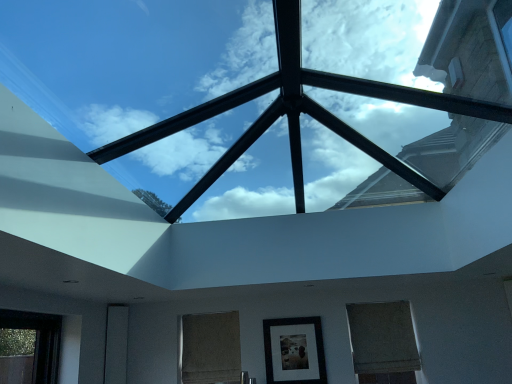
Describe the element at coordinates (211, 348) in the screenshot. I see `burlap curtain at center, which is counted as the 1th window, starting from the left` at that location.

You are a GUI agent. You are given a task and a screenshot of the screen. Output one action in this format:
    pyautogui.click(x=<x>, y=<y>)
    Task: Click on the transparent glass skylight at center
    Image resolution: width=512 pixels, height=384 pixels.
    Given the screenshot: What is the action you would take?
    pyautogui.click(x=280, y=116)

Is matte brown blind at lower right, which ranks as the 1th window in right-to-left order, further to camera compared to transparent glass skylight at center?

Yes.

Considering the positions of objects matte brown blind at lower right, which ranks as the 1th window in right-to-left order, and transparent glass skylight at center in the image provided, who is more to the right, matte brown blind at lower right, which ranks as the 1th window in right-to-left order, or transparent glass skylight at center?

Positioned to the right is matte brown blind at lower right, which ranks as the 1th window in right-to-left order.

Which of these two, matte brown blind at lower right, the 2th window positioned from the left, or transparent glass skylight at center, is wider?

Wider between the two is transparent glass skylight at center.

Does point (397, 312) appear closer or farther from the camera than point (244, 137)?

Point (397, 312) is positioned farther from the camera compared to point (244, 137).

From a real-world perspective, is burlap curtain at center, which is counted as the 1th window, starting from the left, physically above matte black glass door at lower left?

No, from a real-world perspective, burlap curtain at center, which is counted as the 1th window, starting from the left, is not over matte black glass door at lower left

Based on their sizes in the image, would you say burlap curtain at center, which is counted as the 1th window, starting from the left, is bigger or smaller than matte black glass door at lower left?

Considering their sizes, burlap curtain at center, which is counted as the 1th window, starting from the left, takes up more space than matte black glass door at lower left.

Consider the image. Considering their positions, is burlap curtain at center, the 2th window in the right-to-left sequence, located in front of or behind matte black glass door at lower left?

In the image, burlap curtain at center, the 2th window in the right-to-left sequence, appears behind matte black glass door at lower left.

Which object is wider, transparent glass skylight at center or burlap curtain at center, the 2th window in the right-to-left sequence?

transparent glass skylight at center.

How different are the orientations of transparent glass skylight at center and burlap curtain at center, which is counted as the 1th window, starting from the left, in degrees?

89.4 degrees.

Who is more distant, transparent glass skylight at center or burlap curtain at center, the 2th window in the right-to-left sequence?

burlap curtain at center, the 2th window in the right-to-left sequence, is further away from the camera.

Is point (420, 184) closer or farther from the camera than point (203, 369)?

Point (420, 184).

Is burlap curtain at center, which is counted as the 1th window, starting from the left, turned away from matte brown blind at lower right, which ranks as the 1th window in right-to-left order?

No, matte brown blind at lower right, which ranks as the 1th window in right-to-left order, is not at the back of burlap curtain at center, which is counted as the 1th window, starting from the left.

Considering the relative sizes of burlap curtain at center, which is counted as the 1th window, starting from the left, and matte brown blind at lower right, the 2th window positioned from the left, in the image provided, is burlap curtain at center, which is counted as the 1th window, starting from the left, thinner than matte brown blind at lower right, the 2th window positioned from the left,?

Yes, burlap curtain at center, which is counted as the 1th window, starting from the left, is thinner than matte brown blind at lower right, the 2th window positioned from the left.

Can you tell me how much burlap curtain at center, the 2th window in the right-to-left sequence, and matte brown blind at lower right, which ranks as the 1th window in right-to-left order, differ in facing direction?

0.00255 degrees.

From the image's perspective, is burlap curtain at center, which is counted as the 1th window, starting from the left, below matte brown blind at lower right, which ranks as the 1th window in right-to-left order?

Correct, burlap curtain at center, which is counted as the 1th window, starting from the left, appears lower than matte brown blind at lower right, which ranks as the 1th window in right-to-left order, in the image.

Consider the image. Visually, is matte black glass door at lower left positioned to the left or to the right of matte black picture frame at center?

matte black glass door at lower left is to the left of matte black picture frame at center.

Does point (121, 368) come in front of point (312, 361)?

No, it is behind (312, 361).

Which object is thinner, matte black glass door at lower left or matte black picture frame at center?

With smaller width is matte black picture frame at center.

From the image's perspective, is matte black glass door at lower left located beneath matte black picture frame at center?

Yes.

From a real-world perspective, is transparent glass skylight at center positioned above or below matte black picture frame at center?

transparent glass skylight at center is above matte black picture frame at center.

From the picture: Considering their positions, is transparent glass skylight at center located in front of or behind matte black picture frame at center?

Clearly, transparent glass skylight at center is in front of matte black picture frame at center.

Looking at this image, is transparent glass skylight at center spatially inside matte black picture frame at center, or outside of it?

transparent glass skylight at center is located beyond the bounds of matte black picture frame at center.

From the image's perspective, would you say transparent glass skylight at center is positioned over matte black picture frame at center?

Yes, from the image's perspective, transparent glass skylight at center is above matte black picture frame at center.

Is transparent glass skylight at center at the back of burlap curtain at center, which is counted as the 1th window, starting from the left?

burlap curtain at center, which is counted as the 1th window, starting from the left, does not have its back to transparent glass skylight at center.

From a real-world perspective, is burlap curtain at center, which is counted as the 1th window, starting from the left, located higher than transparent glass skylight at center?

No, from a real-world perspective, burlap curtain at center, which is counted as the 1th window, starting from the left, is not over transparent glass skylight at center

Which of these two, burlap curtain at center, the 2th window in the right-to-left sequence, or transparent glass skylight at center, is smaller?

burlap curtain at center, the 2th window in the right-to-left sequence, is smaller.

At what (x,y) coordinates should I click in order to perform the action: click on window that is the 2nd one below the transparent glass skylight at center (from a real-world perspective). Please return your answer as a coordinate pair (x, y). Looking at the image, I should click on (383, 343).

Image resolution: width=512 pixels, height=384 pixels. What are the coordinates of `glass door that is above the burlap curtain at center, which is counted as the 1th window, starting from the left (from a real-world perspective)` in the screenshot? It's located at (116, 344).

Based on their spatial positions, is burlap curtain at center, which is counted as the 1th window, starting from the left, or matte black glass door at lower left further from transparent glass skylight at center?

Among the two, matte black glass door at lower left is located further to transparent glass skylight at center.

Based on their spatial positions, is transparent glass skylight at center or matte black picture frame at center closer to matte brown blind at lower right, the 2th window positioned from the left?

Based on the image, matte black picture frame at center appears to be nearer to matte brown blind at lower right, the 2th window positioned from the left.

Looking at this image, estimate the real-world distances between objects in this image. Which object is further from matte brown blind at lower right, which ranks as the 1th window in right-to-left order, matte black picture frame at center or transparent glass skylight at center?

transparent glass skylight at center is further to matte brown blind at lower right, which ranks as the 1th window in right-to-left order.

Considering their positions, is transparent glass skylight at center positioned further to matte black glass door at lower left than burlap curtain at center, the 2th window in the right-to-left sequence?

Based on the image, transparent glass skylight at center appears to be further to matte black glass door at lower left.

Based on their spatial positions, is matte black picture frame at center or burlap curtain at center, which is counted as the 1th window, starting from the left, closer to matte black glass door at lower left?

burlap curtain at center, which is counted as the 1th window, starting from the left.

Considering their positions, is burlap curtain at center, the 2th window in the right-to-left sequence, positioned closer to matte black glass door at lower left than matte brown blind at lower right, the 2th window positioned from the left?

Based on the image, burlap curtain at center, the 2th window in the right-to-left sequence, appears to be nearer to matte black glass door at lower left.

Based on their spatial positions, is matte black glass door at lower left or matte black picture frame at center closer to burlap curtain at center, the 2th window in the right-to-left sequence?

Among the two, matte black picture frame at center is located nearer to burlap curtain at center, the 2th window in the right-to-left sequence.

Looking at the image, which one is located further to burlap curtain at center, the 2th window in the right-to-left sequence, transparent glass skylight at center or matte black glass door at lower left?

transparent glass skylight at center.

At what (x,y) coordinates should I click in order to perform the action: click on picture frame between transparent glass skylight at center and burlap curtain at center, the 2th window in the right-to-left sequence, in the front-back direction. Please return your answer as a coordinate pair (x, y). Looking at the image, I should click on (294, 351).

The width and height of the screenshot is (512, 384). I want to click on window positioned between transparent glass skylight at center and matte black glass door at lower left from near to far, so click(x=383, y=343).

Where is `picture frame positioned between transparent glass skylight at center and matte brown blind at lower right, which ranks as the 1th window in right-to-left order, from near to far`? Image resolution: width=512 pixels, height=384 pixels. picture frame positioned between transparent glass skylight at center and matte brown blind at lower right, which ranks as the 1th window in right-to-left order, from near to far is located at coordinates (294, 351).

Locate an element on the screen. The width and height of the screenshot is (512, 384). window between transparent glass skylight at center and burlap curtain at center, the 2th window in the right-to-left sequence, in the front-back direction is located at coordinates (383, 343).